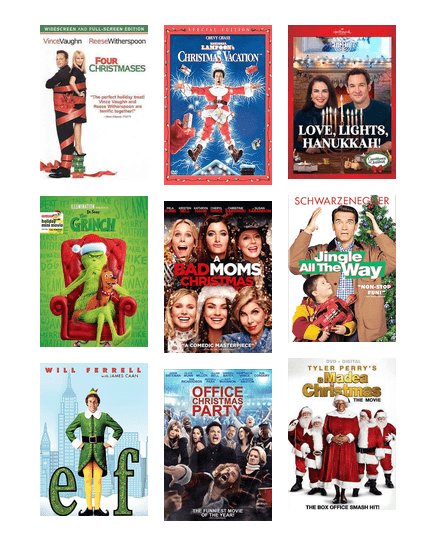
You are a GUI agent. You are given a task and a screenshot of the screen. Output one action in this format:
    pyautogui.click(x=<x>, y=<y>)
    Task: Click on the movie poster
    Image resolution: width=436 pixels, height=546 pixels.
    Given the screenshot: What is the action you would take?
    pyautogui.click(x=100, y=450), pyautogui.click(x=269, y=467), pyautogui.click(x=360, y=465), pyautogui.click(x=343, y=233), pyautogui.click(x=189, y=240), pyautogui.click(x=106, y=251), pyautogui.click(x=115, y=134), pyautogui.click(x=208, y=145), pyautogui.click(x=371, y=144)